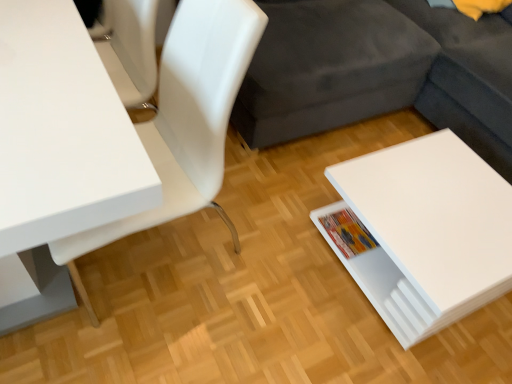
Where is `free space in front of multicolored paper book at lower right`? This screenshot has width=512, height=384. free space in front of multicolored paper book at lower right is located at coordinates (340, 294).